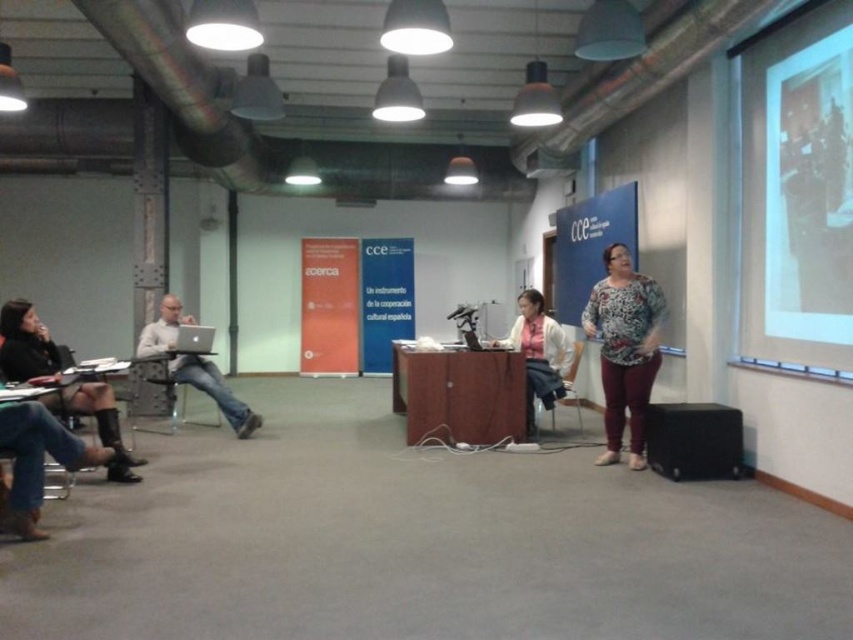
You are an event organizer setting up a presentation. You have a white matte projection screen at upper right and a black matte speaker at lower right. Which object has a smaller width?

The white matte projection screen at upper right has a smaller width compared to the black matte speaker at lower right.

You are attending a presentation and need to locate both the white matte projection screen at upper right and the black matte speaker at lower right. Which object is bigger?

The white matte projection screen at upper right is larger in size than the black matte speaker at lower right.